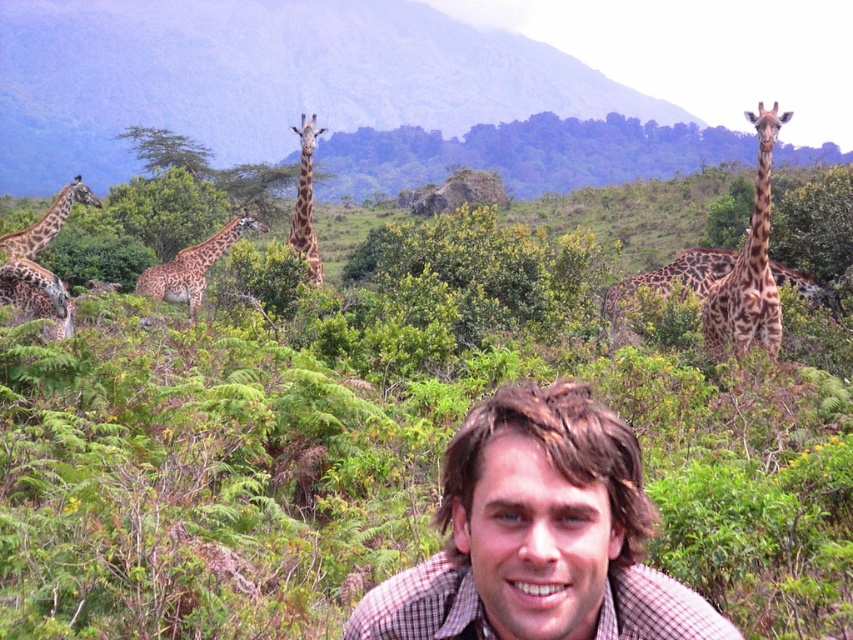
You are standing in the savanna scene and want to take a photo of the green leafy bush at center. Where should you position yourself to capture it in the frame?

The green leafy bush at center is located at coordinates 0.700 on the x axis and 0.447 on the y axis, so you should position yourself facing the center area of the image to capture it in the frame.

You are a wildlife photographer trying to capture a photo of both the spotted brown giraffe at center and the spotted fur giraffe at lower left. Based on their positions, which giraffe is positioned more to the right side of the image?

The spotted brown giraffe at center is positioned more to the right side of the image compared to the spotted fur giraffe at lower left.